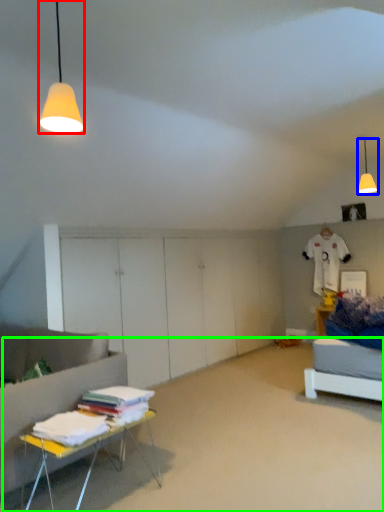
Question: Which object is positioned closest to lamp (highlighted by a red box)? Select from lamp (highlighted by a blue box) and plain (highlighted by a green box).

Choices:
 (A) lamp
 (B) plain

Answer: (B)